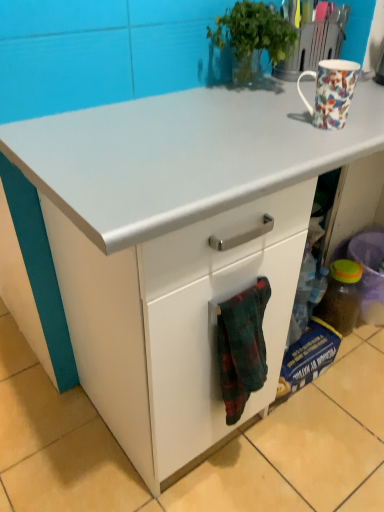
You are a GUI agent. You are given a task and a screenshot of the screen. Output one action in this format:
    pyautogui.click(x=<x>, y=<y>)
    Task: Click on the free spot to the left of floral porcelain mug at upper right
    
    Given the screenshot: What is the action you would take?
    pyautogui.click(x=249, y=125)